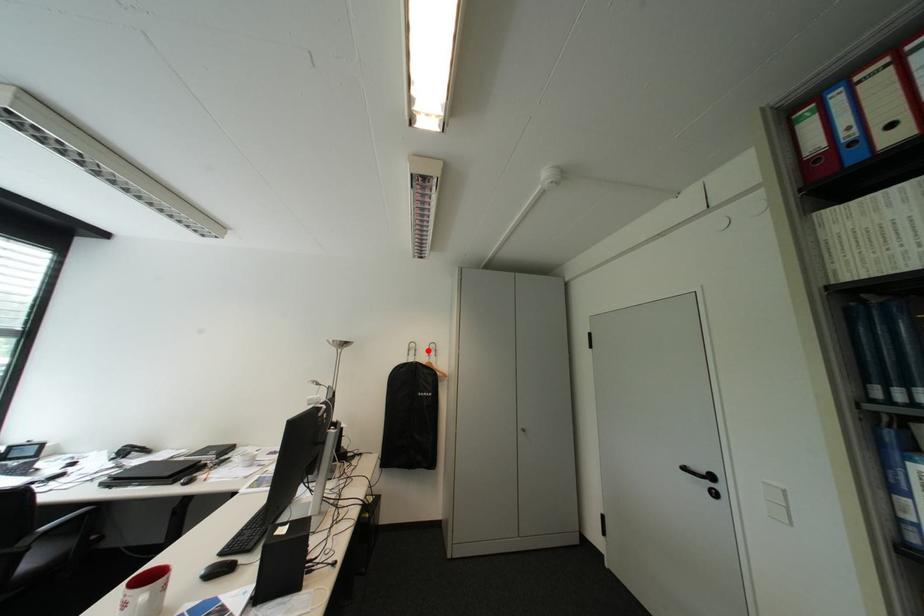
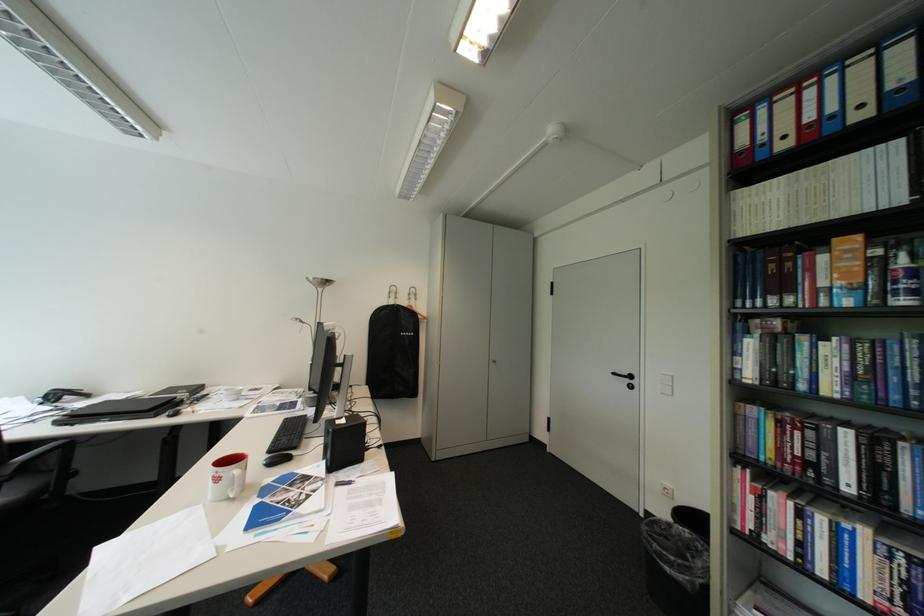
Question: I am providing you with two images of the same scene from different viewpoints. A red point is marked on the first image. Is the red point's position out of view in image 2?

Choices:
 (A) Yes
 (B) No

Answer: (B)